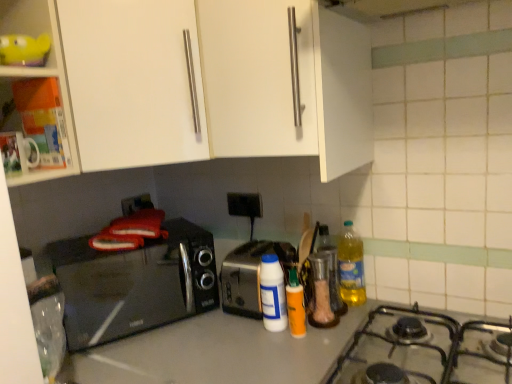
The height and width of the screenshot is (384, 512). Identify the location of vacant region to the right of white plastic bottle at center, which ranks as the third bottle in right-to-left order. (333, 327).